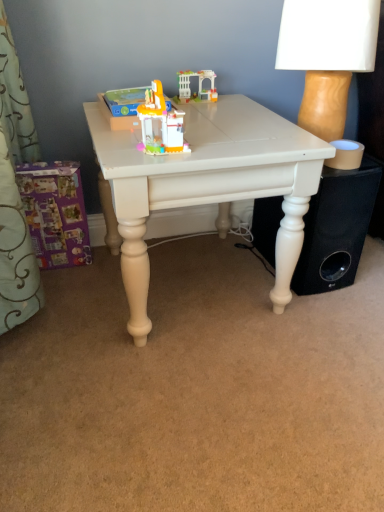
You are a GUI agent. You are given a task and a screenshot of the screen. Output one action in this format:
    pyautogui.click(x=<x>, y=<y>)
    Task: Click on the free space in front of white painted wood table at center
    The image size is (384, 512).
    Given the screenshot: What is the action you would take?
    pyautogui.click(x=190, y=402)